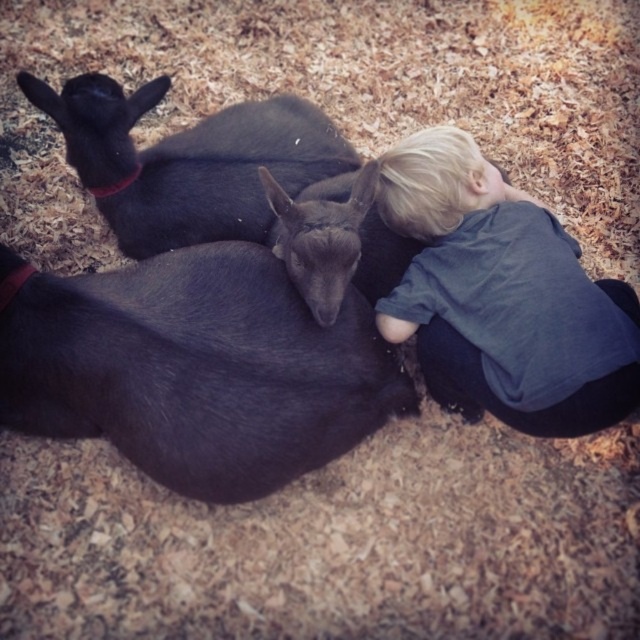
You are a photographer trying to capture the child and the two goats in the scene. You notice two specific points marked in the image. The first point is at coordinate point (36, 358) and the second is at point (582, 273). If you want to focus on the point that is closer to the camera, which coordinate should you choose?

Point (36, 358) is in front of point (582, 273), so you should focus on point (36, 358) to capture the closer one.

You are a photographer trying to capture the child and the goats in the scene. You notice a specific point at coordinates point (196, 365). Where is this point located in relation to the shiny black goat at center?

The point (196, 365) is located on the shiny black goat at center.